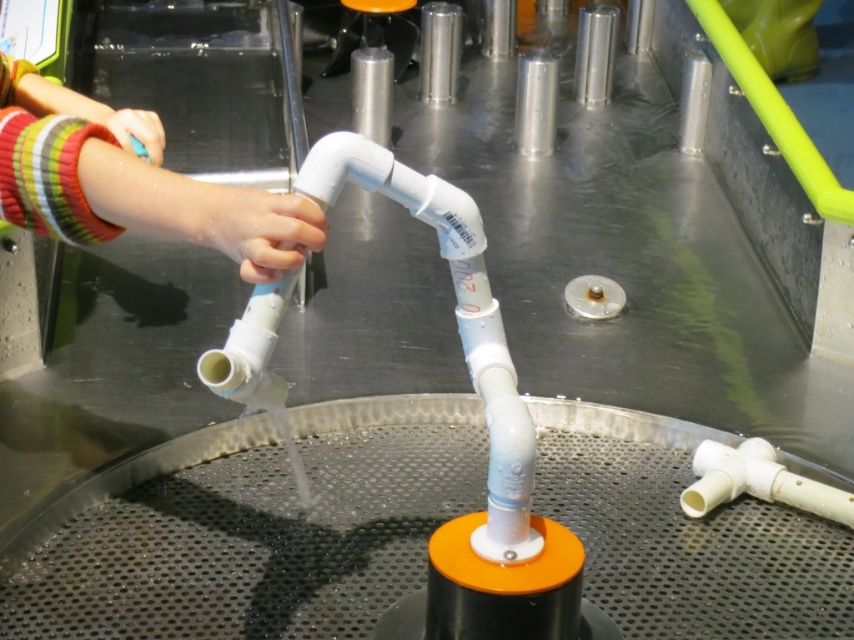
Does white matte hand at center come behind matte plastic hand at upper left?

No, white matte hand at center is closer to the viewer.

Looking at this image, can you confirm if white matte hand at center is positioned to the left of matte plastic hand at upper left?

No, white matte hand at center is not to the left of matte plastic hand at upper left.

Locate an element on the screen. Image resolution: width=854 pixels, height=640 pixels. white matte hand at center is located at coordinates (259, 228).